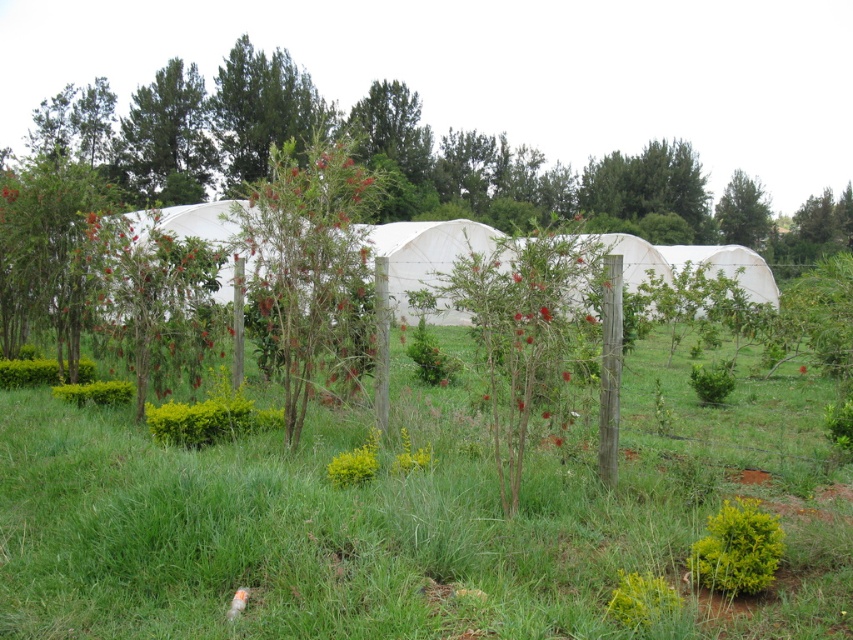
Question: Can you confirm if green grass at center is wider than green matte tree at upper center?

Choices:
 (A) no
 (B) yes

Answer: (B)

Question: Which point is farther to the camera?

Choices:
 (A) green grass at center
 (B) green leafy tree at upper right
 (C) red matte flower at center

Answer: (B)

Question: Which of these objects is positioned closest to the red matte flower at center?

Choices:
 (A) green matte tree at upper center
 (B) green matte tree at upper left
 (C) green grass at center

Answer: (C)

Question: Estimate the real-world distances between objects in this image. Which object is farther from the green matte tree at upper left?

Choices:
 (A) green matte tree at upper center
 (B) green grass at center
 (C) green leafy tree at upper right
 (D) red matte flower at center

Answer: (D)

Question: Is green matte tree at upper center positioned before red matte flower at center?

Choices:
 (A) no
 (B) yes

Answer: (A)

Question: Is green grass at center closer to the viewer compared to red matte flower at center?

Choices:
 (A) yes
 (B) no

Answer: (A)